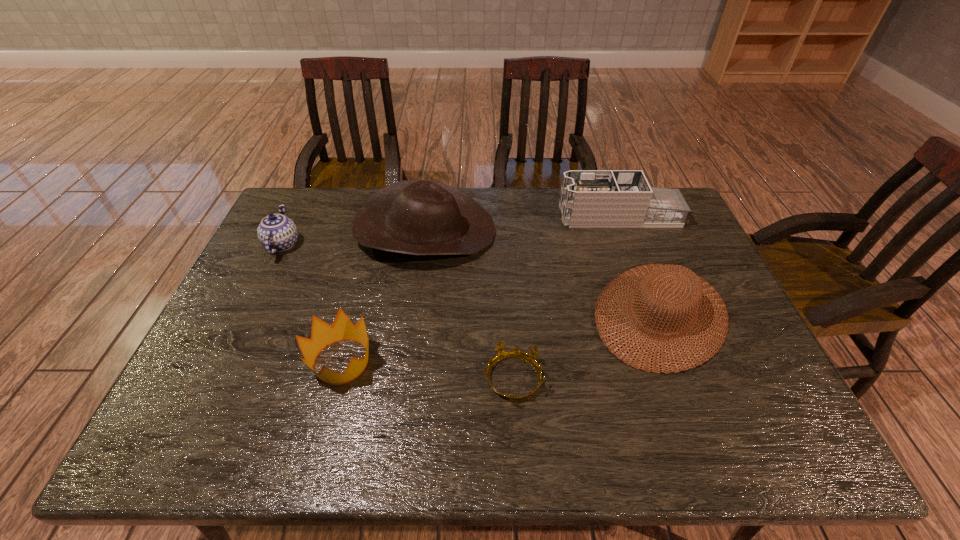
You are a GUI agent. You are given a task and a screenshot of the screen. Output one action in this format:
    pyautogui.click(x=<x>, y=<y>)
    Task: Click on the blank area in the image that satisfies the following two spatial constraints: 1. at the entrance of the sunhat; 2. on the left side of the dollhouse
    The width and height of the screenshot is (960, 540).
    Given the screenshot: What is the action you would take?
    pyautogui.click(x=655, y=314)

The height and width of the screenshot is (540, 960). In order to click on vacant position in the image that satisfies the following two spatial constraints: 1. at the entrance of the sunhat; 2. on the left side of the dollhouse in this screenshot , I will do `click(655, 314)`.

Identify the location of free region that satisfies the following two spatial constraints: 1. at the spout of the chinaware; 2. on the back side of the right crown. (218, 379).

Find the location of a particular element. Image resolution: width=960 pixels, height=540 pixels. vacant position in the image that satisfies the following two spatial constraints: 1. on the back side of the shortest object; 2. at the spout of the leftmost object is located at coordinates (505, 245).

Where is `free location that satisfies the following two spatial constraints: 1. at the spout of the chinaware; 2. on the back side of the right crown`? The width and height of the screenshot is (960, 540). free location that satisfies the following two spatial constraints: 1. at the spout of the chinaware; 2. on the back side of the right crown is located at coordinates (218, 379).

You are a GUI agent. You are given a task and a screenshot of the screen. Output one action in this format:
    pyautogui.click(x=<x>, y=<y>)
    Task: Click on the free space in the image that satisfies the following two spatial constraints: 1. on the back side of the sunhat; 2. on the right side of the left crown
    
    Given the screenshot: What is the action you would take?
    coord(354,314)

This screenshot has width=960, height=540. What are the coordinates of `vacant region that satisfies the following two spatial constraints: 1. at the spout of the leftmost object; 2. on the left side of the taller crown` in the screenshot? It's located at (227, 361).

Locate an element on the screen. free space in the image that satisfies the following two spatial constraints: 1. at the entrance of the dollhouse; 2. on the front side of the cowboy hat is located at coordinates (625, 232).

Locate an element on the screen. Image resolution: width=960 pixels, height=540 pixels. blank area in the image that satisfies the following two spatial constraints: 1. at the spout of the chinaware; 2. on the back side of the shortest object is located at coordinates (218, 379).